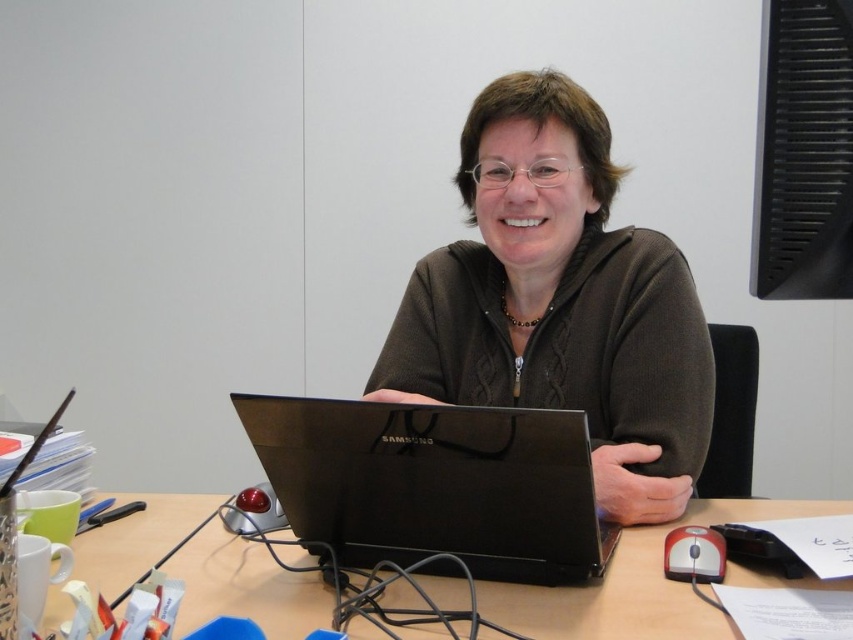
Does brown sweater at center have a lesser width compared to black matte laptop at center?

Incorrect, brown sweater at center's width is not less than black matte laptop at center's.

Is the position of brown sweater at center less distant than that of black matte laptop at center?

No, brown sweater at center is behind black matte laptop at center.

Image resolution: width=853 pixels, height=640 pixels. I want to click on brown sweater at center, so click(x=560, y=301).

Measure the distance between point [527,161] and camera.

A distance of 4.04 feet exists between point [527,161] and camera.

Which is in front, point (607, 132) or point (265, 620)?

Point (265, 620) is in front.

Find the location of a particular element. brown sweater at center is located at coordinates (560, 301).

Which of these two, black matte laptop at center or wooden table at center, stands taller?

black matte laptop at center

Is black matte laptop at center shorter than wooden table at center?

In fact, black matte laptop at center may be taller than wooden table at center.

Who is more forward, (418, 552) or (158, 504)?

Point (418, 552) is more forward.

I want to click on black matte laptop at center, so click(x=434, y=484).